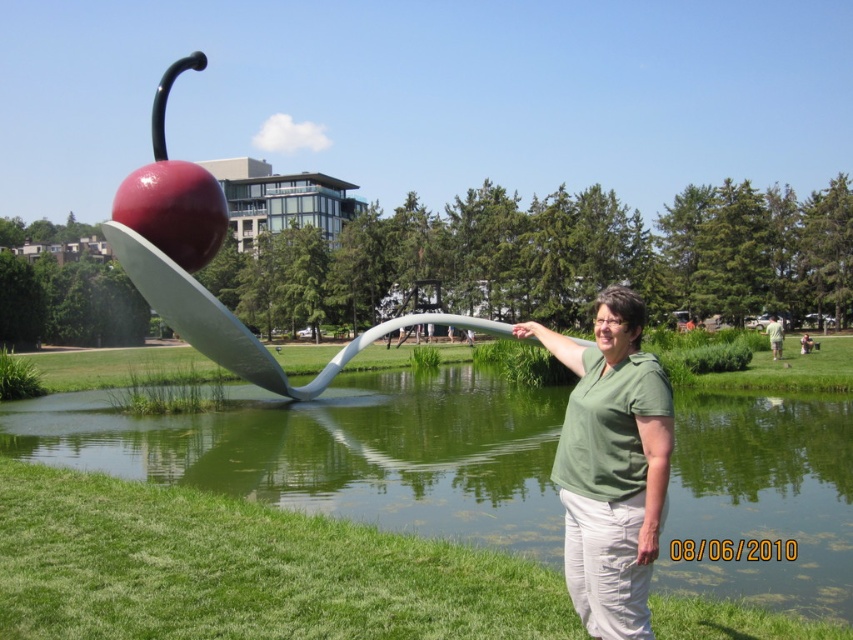
Consider the image. Is green matte shirt at center in front of glossy red apple at center?

Yes, it is in front of glossy red apple at center.

The image size is (853, 640). I want to click on green matte shirt at center, so click(x=611, y=465).

Find the location of a particular element. The image size is (853, 640). green matte shirt at center is located at coordinates [x=611, y=465].

Is green liquid water at lower center bigger than glossy red apple at center?

No.

Does point (844, 579) come farther from viewer compared to point (115, 202)?

No, it is in front of (115, 202).

Between point (828, 508) and point (207, 225), which one is positioned behind?

Point (207, 225)

At what (x,y) coordinates should I click in order to perform the action: click on green liquid water at lower center. Please return your answer as a coordinate pair (x, y). Looking at the image, I should click on (337, 451).

Who is positioned more to the left, green liquid water at lower center or green matte shirt at center?

Positioned to the left is green liquid water at lower center.

Who is lower down, green liquid water at lower center or green matte shirt at center?

green liquid water at lower center

Is point (80, 464) closer to viewer compared to point (616, 634)?

No, it is behind (616, 634).

You are a GUI agent. You are given a task and a screenshot of the screen. Output one action in this format:
    pyautogui.click(x=<x>, y=<y>)
    Task: Click on the green liquid water at lower center
    
    Given the screenshot: What is the action you would take?
    pyautogui.click(x=337, y=451)